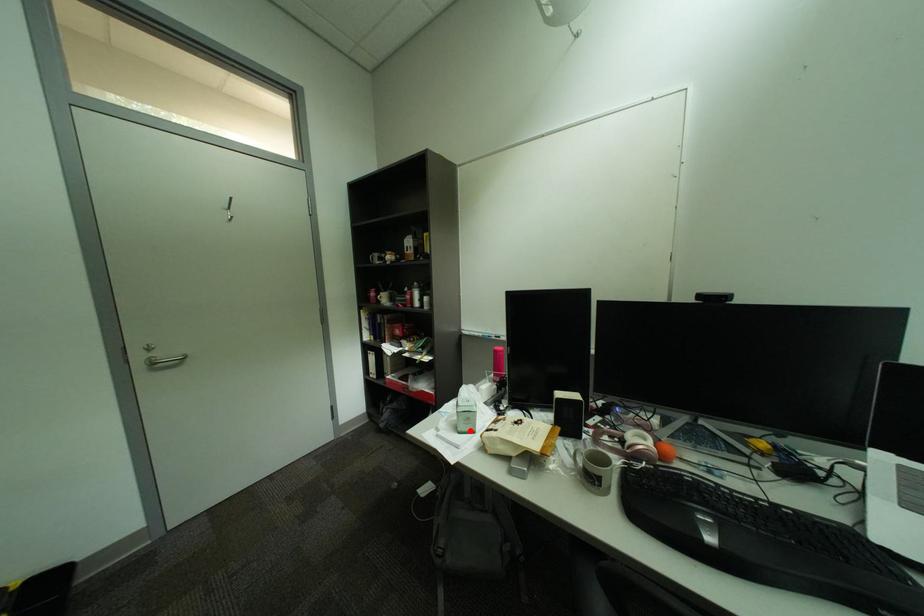
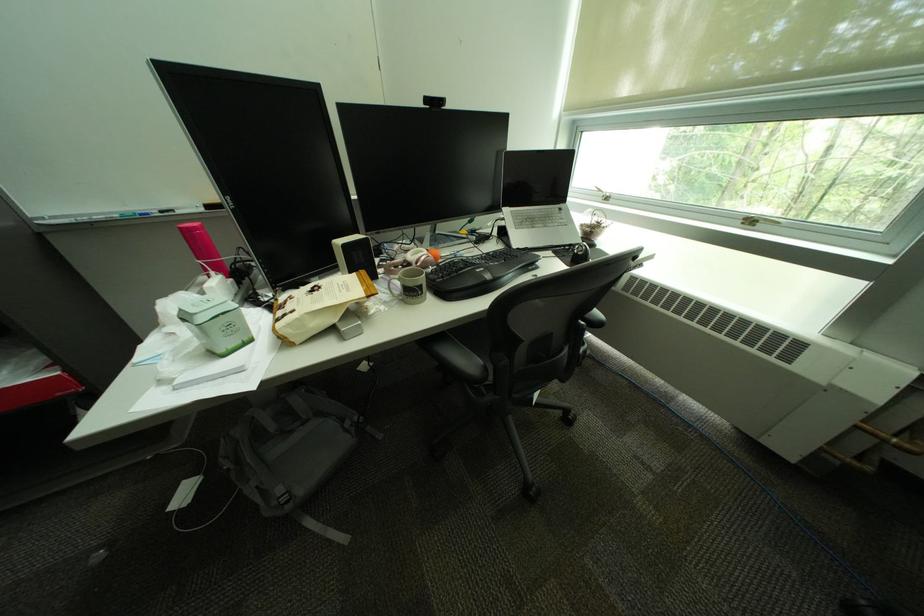
Question: I am providing you with two images of the same scene from different viewpoints. A red point is shown in image1. For the corresponding object point in image2, is it positioned nearer or farther from the camera?

Choices:
 (A) Nearer
 (B) Farther

Answer: (A)